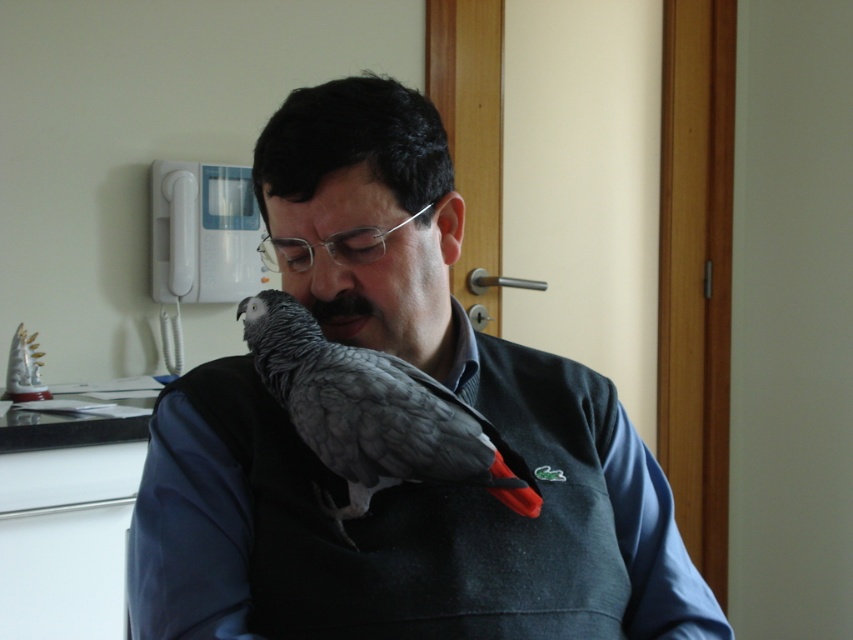
Question: Is matte gray bird at center to the left of gray matte parrot at center from the viewer's perspective?

Choices:
 (A) yes
 (B) no

Answer: (B)

Question: Among these objects, which one is farthest from the camera?

Choices:
 (A) matte gray bird at center
 (B) gray matte parrot at center

Answer: (B)

Question: Is matte gray bird at center below gray matte parrot at center?

Choices:
 (A) no
 (B) yes

Answer: (B)

Question: Which of the following is the farthest from the observer?

Choices:
 (A) matte gray bird at center
 (B) gray matte parrot at center

Answer: (B)

Question: Among these objects, which one is farthest from the camera?

Choices:
 (A) gray matte parrot at center
 (B) matte gray bird at center

Answer: (A)

Question: Can you confirm if matte gray bird at center is positioned above gray matte parrot at center?

Choices:
 (A) no
 (B) yes

Answer: (A)